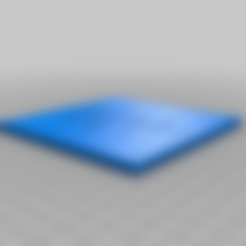
At what (x,y) coordinates should I click in order to perform the action: click on wall. Please return your answer as a coordinate pair (x, y). This screenshot has width=246, height=246. Looking at the image, I should click on [103, 67].